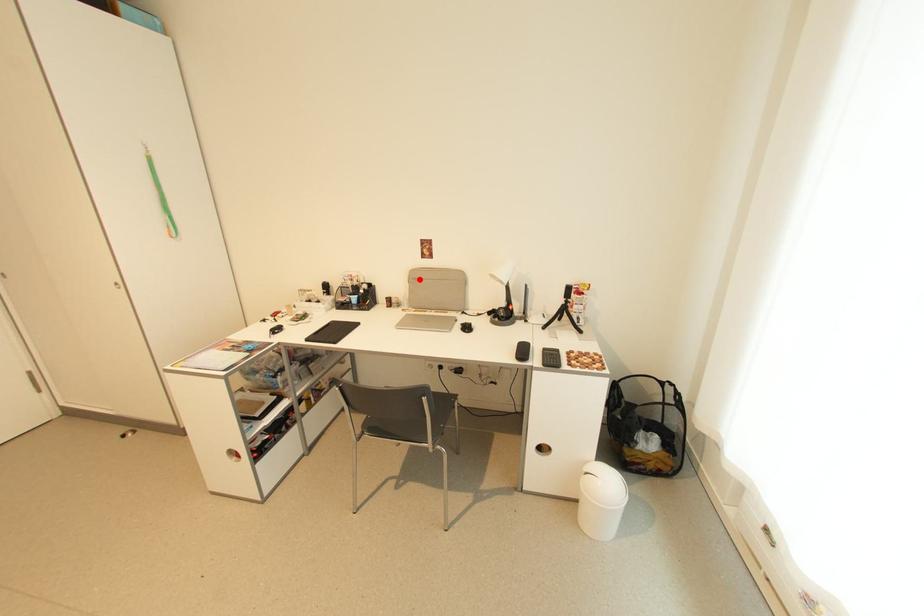
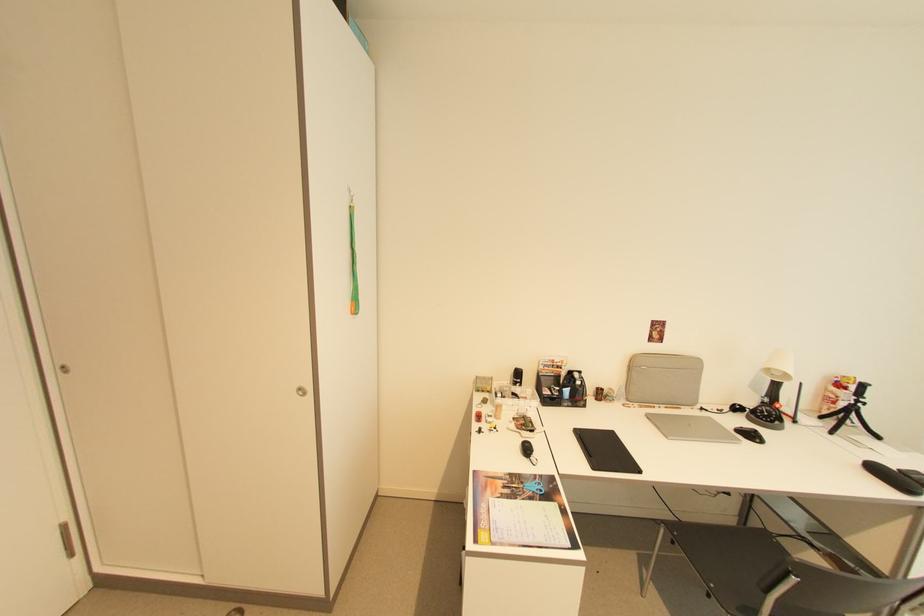
In the second image, find the point that corresponds to the highlighted location in the first image.

(638, 366)